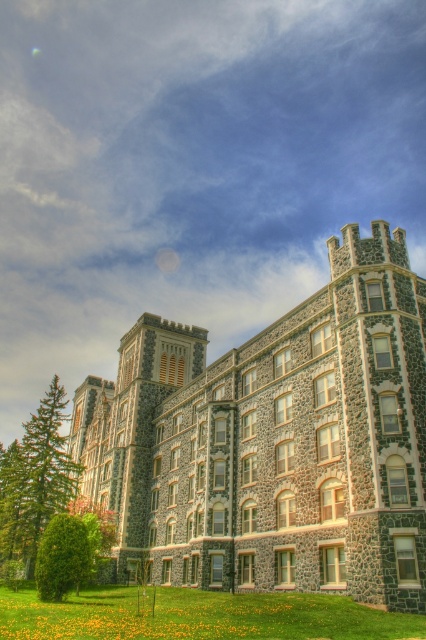
Consider the image. You are standing in front of the grand stone building and want to determine the relative positions of two points marked on the lawn. Which point is closer to you, point (63, 604) or point (42, 541)?

Point (63, 604) is closer to the viewer than point (42, 541).

You are standing in front of the grand stone building and see a point marked at coordinates (34, 480). What object is located at that point?

The point at (34, 480) marks a green textured pine tree at left.